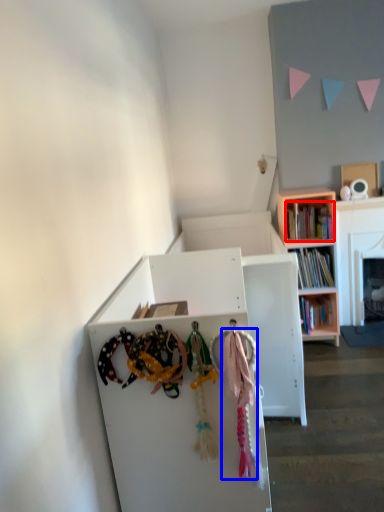
Question: Among these objects, which one is nearest to the camera, book (highlighted by a red box) or clothesline (highlighted by a blue box)?

Choices:
 (A) book
 (B) clothesline

Answer: (B)